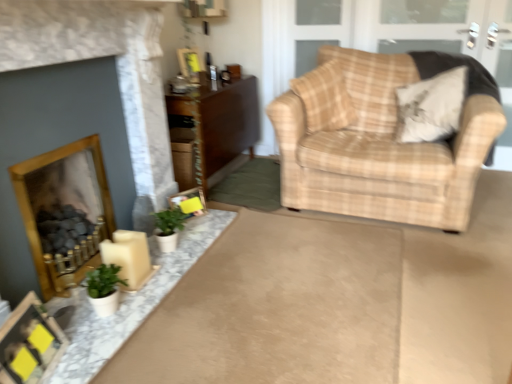
Find the location of a particular element. This screenshot has width=512, height=384. free space below green matte plant at lower left, positioned as the second houseplant in front-to-back order (from a real-world perspective) is located at coordinates (179, 242).